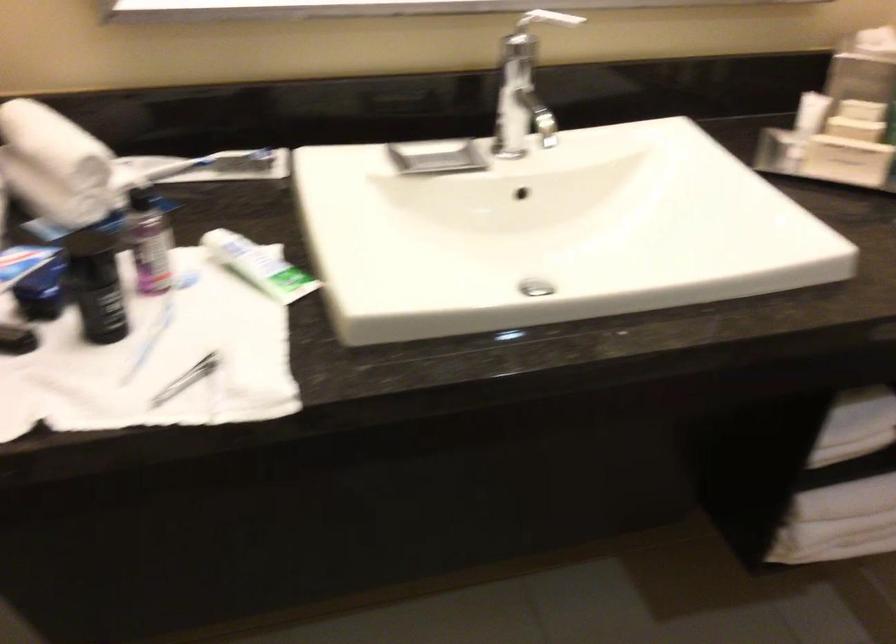
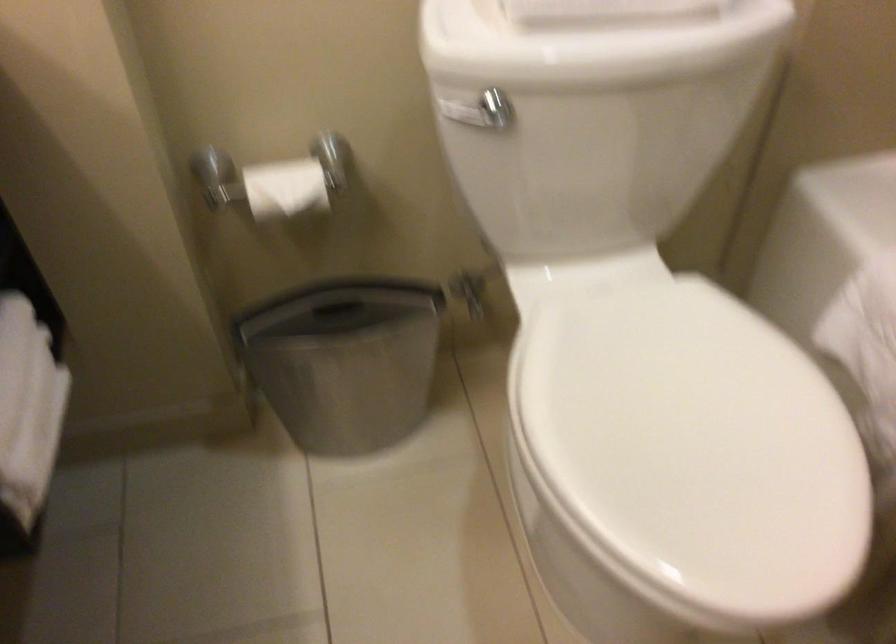
How did the camera likely rotate?

The camera's rotation is toward right-down.